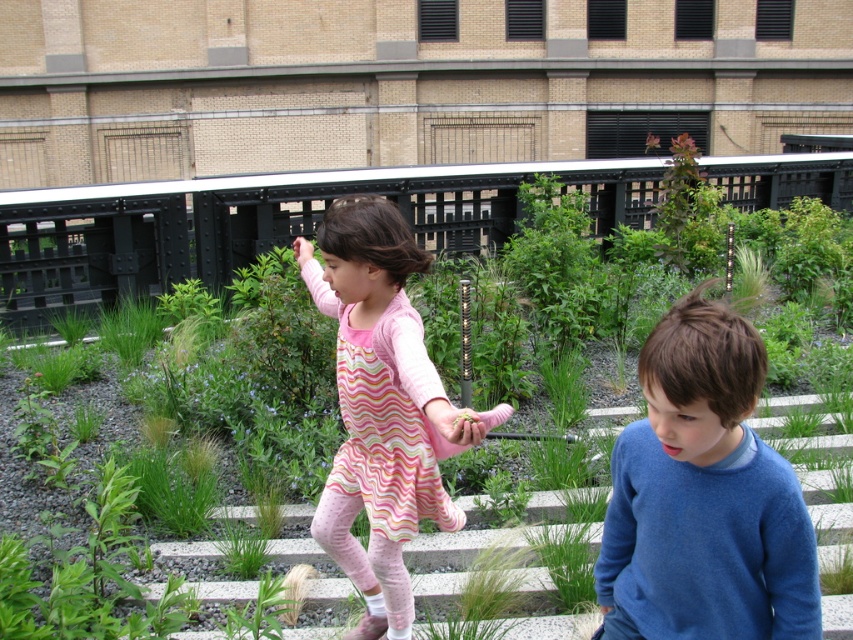
Question: Which of the following is the farthest from the observer?

Choices:
 (A) (776, 474)
 (B) (19, 209)

Answer: (B)

Question: Is green grass at center wider than pink striped dress at center?

Choices:
 (A) no
 (B) yes

Answer: (B)

Question: Among these objects, which one is farthest from the camera?

Choices:
 (A) green grass at center
 (B) pink striped dress at center
 (C) white concrete stairs at center
 (D) blue cotton sweater at lower right

Answer: (A)

Question: Does blue cotton sweater at lower right have a lesser width compared to pink striped dress at center?

Choices:
 (A) yes
 (B) no

Answer: (A)

Question: Which object is positioned farthest from the pink striped dress at center?

Choices:
 (A) green grass at center
 (B) white concrete stairs at center
 (C) blue cotton sweater at lower right

Answer: (A)

Question: Does blue cotton sweater at lower right appear on the right side of white concrete stairs at center?

Choices:
 (A) no
 (B) yes

Answer: (A)